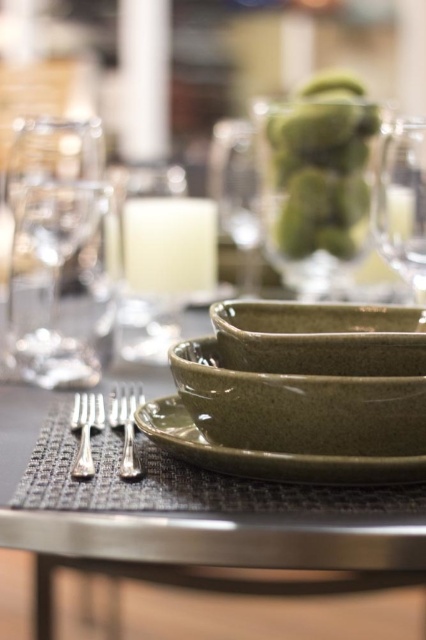
You are a guest at a formal dinner and notice two silver forks on your place setting. The silver polished fork at left and the silver metallic fork at left are both present. Which fork should you use first according to proper etiquette, the one closer to you or the one farther away?

According to the description, the silver metallic fork at left is behind the silver polished fork at left. In formal dining etiquette, the fork closest to you is used first. Therefore, you should use the silver polished fork at left first.

You are a server at a restaurant and need to place a 24 inch tall drink on the table. The green speckled glass at upper center is where you want to put it. Is the glass far enough from the edge of the table to safely place the drink without it tipping over?

The green speckled glass at upper center is 24.53 inches away from the viewer, which is sufficient distance from the table edge to safely place a 24 inch tall drink without tipping over.